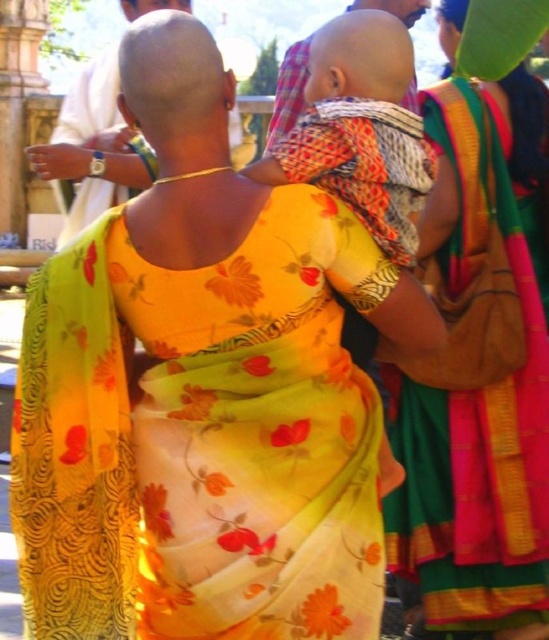
Question: Is yellow floral fabric dress at center positioned at the back of yellow floral sari at center?

Choices:
 (A) yes
 (B) no

Answer: (B)

Question: Estimate the real-world distances between objects in this image. Which object is farther from the matte gold necklace at upper center?

Choices:
 (A) patterned fabric baby at center
 (B) yellow floral sari at center

Answer: (B)

Question: Is yellow floral fabric dress at center positioned in front of matte gold necklace at upper center?

Choices:
 (A) no
 (B) yes

Answer: (B)

Question: Is yellow floral fabric dress at center closer to the viewer compared to patterned fabric baby at center?

Choices:
 (A) no
 (B) yes

Answer: (B)

Question: Estimate the real-world distances between objects in this image. Which object is farther from the patterned fabric baby at center?

Choices:
 (A) matte gold necklace at upper center
 (B) yellow floral sari at center
 (C) yellow floral fabric dress at center

Answer: (C)

Question: Which object appears closest to the camera in this image?

Choices:
 (A) patterned fabric baby at center
 (B) matte gold necklace at upper center
 (C) yellow floral fabric dress at center

Answer: (C)